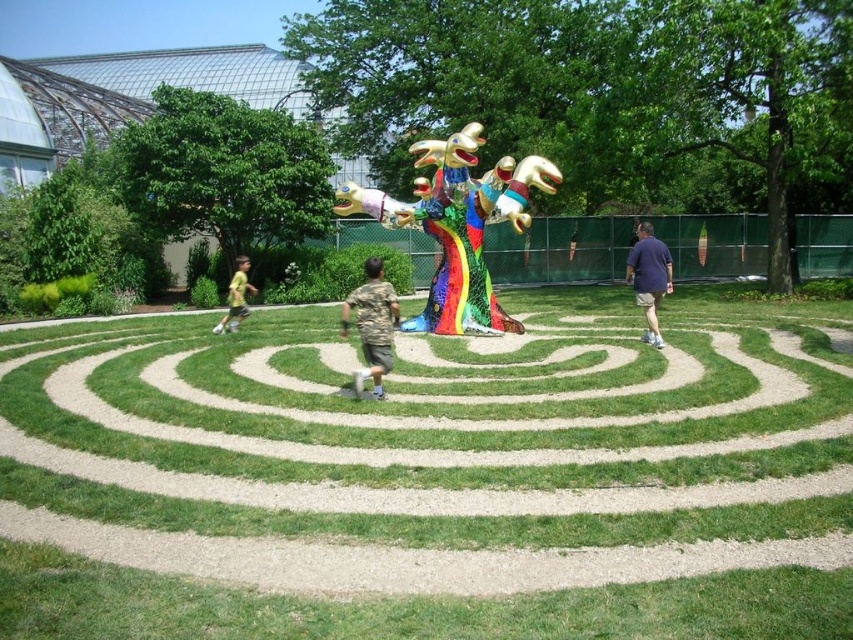
Does camouflage fabric shirt at center appear on the left side of dark blue shirt at right?

Yes, camouflage fabric shirt at center is to the left of dark blue shirt at right.

Who is taller, camouflage fabric shirt at center or dark blue shirt at right?

With more height is dark blue shirt at right.

Locate an element on the screen. The image size is (853, 640). camouflage fabric shirt at center is located at coordinates (372, 324).

Is dark blue shirt at right below yellow cotton shirt at left?

Actually, dark blue shirt at right is above yellow cotton shirt at left.

Between dark blue shirt at right and yellow cotton shirt at left, which one appears on the right side from the viewer's perspective?

dark blue shirt at right

Does point (647, 269) come in front of point (241, 275)?

Yes, it is.

You are a GUI agent. You are given a task and a screenshot of the screen. Output one action in this format:
    pyautogui.click(x=<x>, y=<y>)
    Task: Click on the dark blue shirt at right
    
    Given the screenshot: What is the action you would take?
    pyautogui.click(x=648, y=276)

Who is higher up, camouflage fabric shirt at center or yellow cotton shirt at left?

Positioned higher is yellow cotton shirt at left.

Is camouflage fabric shirt at center below yellow cotton shirt at left?

Correct, camouflage fabric shirt at center is located below yellow cotton shirt at left.

Is point (366, 352) positioned before point (244, 298)?

That is True.

This screenshot has height=640, width=853. In order to click on camouflage fabric shirt at center in this screenshot , I will do `click(372, 324)`.